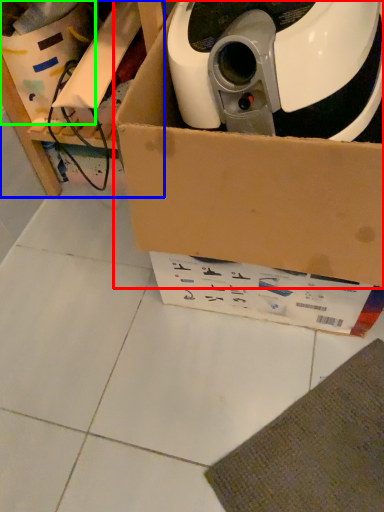
Question: Estimate the real-world distances between objects in this image. Which object is farther from box (highlighted by a red box), furniture (highlighted by a blue box) or storage box (highlighted by a green box)?

Choices:
 (A) furniture
 (B) storage box

Answer: (B)